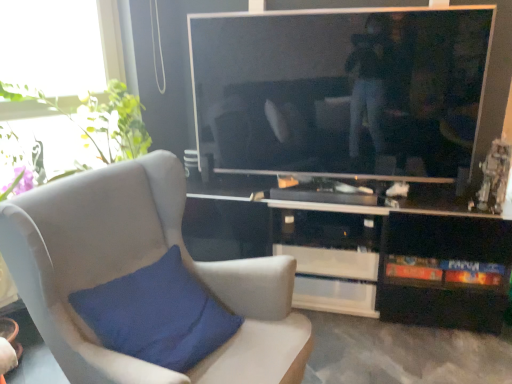
Question: Is green leafy plant at upper left taller or shorter than black glossy cabinet at lower right?

Choices:
 (A) tall
 (B) short

Answer: (B)

Question: Is green leafy plant at upper left to the left or to the right of black glossy cabinet at lower right in the image?

Choices:
 (A) left
 (B) right

Answer: (A)

Question: Which object is positioned farthest from the black glossy cabinet at lower right?

Choices:
 (A) suede-like beige chair at left
 (B) green leafy plant at upper left

Answer: (B)

Question: Considering the real-world distances, which object is farthest from the green leafy plant at upper left?

Choices:
 (A) suede-like beige chair at left
 (B) black glossy cabinet at lower right

Answer: (B)